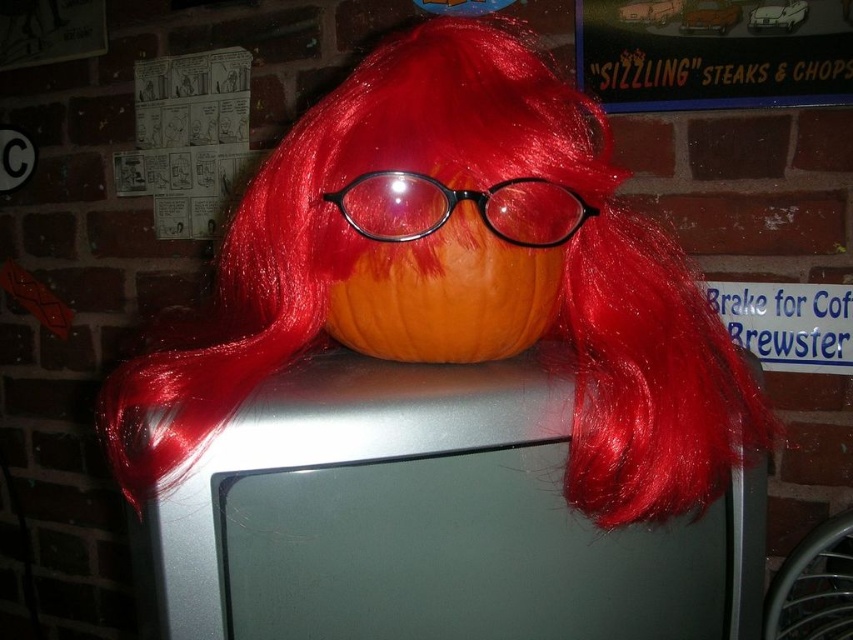
Question: Which point is closer to the camera?

Choices:
 (A) (473, 360)
 (B) (526, 230)

Answer: (B)

Question: Observing the image, what is the correct spatial positioning of matte orange pumpkin at center in reference to black plastic glasses at center?

Choices:
 (A) right
 (B) left

Answer: (A)

Question: Which point is closer to the camera taking this photo?

Choices:
 (A) (374, 292)
 (B) (402, 189)

Answer: (B)

Question: Does matte orange pumpkin at center have a lesser width compared to black plastic glasses at center?

Choices:
 (A) no
 (B) yes

Answer: (A)

Question: Which object is the closest to the matte orange pumpkin at center?

Choices:
 (A) orange matte pumpkin at center
 (B) black plastic glasses at center

Answer: (A)

Question: Is matte orange pumpkin at center to the left of black plastic glasses at center from the viewer's perspective?

Choices:
 (A) no
 (B) yes

Answer: (A)